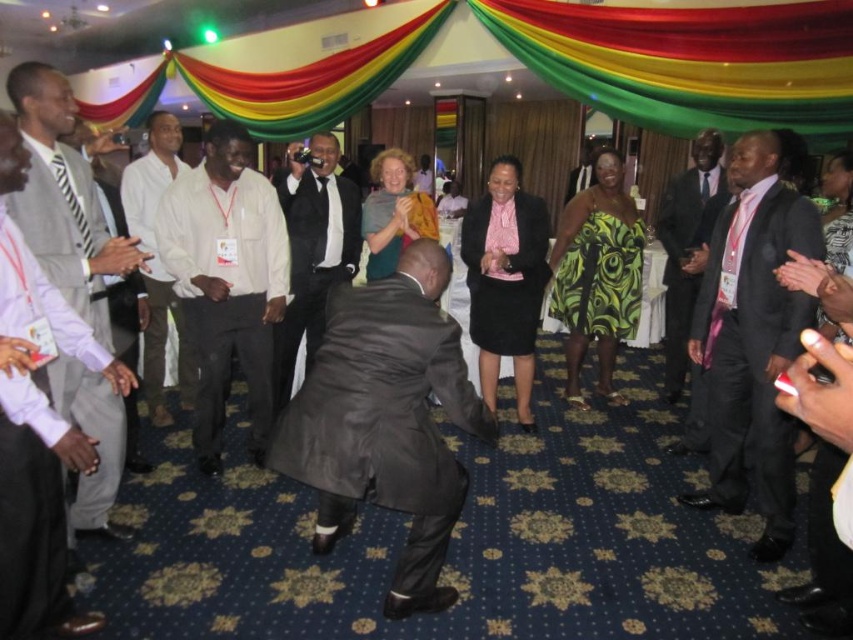
Is pink satin dress at center thinner than dark gray suit at right?

No.

Is pink satin dress at center positioned behind dark gray suit at right?

That is False.

Does point (498, 301) come behind point (715, 205)?

No, (498, 301) is in front of (715, 205).

Locate an element on the screen. The image size is (853, 640). pink satin dress at center is located at coordinates (506, 280).

Which is above, white matte shirt at center or white cotton shirt at center?

white cotton shirt at center is above.

Is the position of white matte shirt at center less distant than that of white cotton shirt at center?

That is False.

Does point (234, 225) come behind point (160, 141)?

No, (234, 225) is closer to viewer.

Locate an element on the screen. The width and height of the screenshot is (853, 640). white matte shirt at center is located at coordinates (225, 280).

Is green printed dress at center positioned before dark gray suit at right?

No, green printed dress at center is further to the viewer.

Does green printed dress at center appear under dark gray suit at right?

No.

Between point (587, 332) and point (660, 212), which one is positioned behind?

The point (660, 212) is more distant.

Image resolution: width=853 pixels, height=640 pixels. What are the coordinates of `green printed dress at center` in the screenshot? It's located at (599, 276).